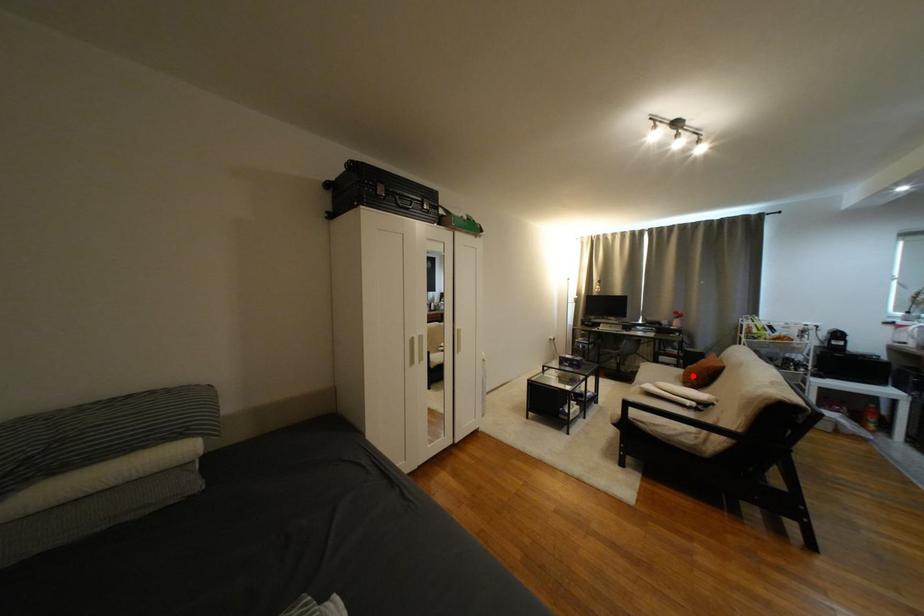
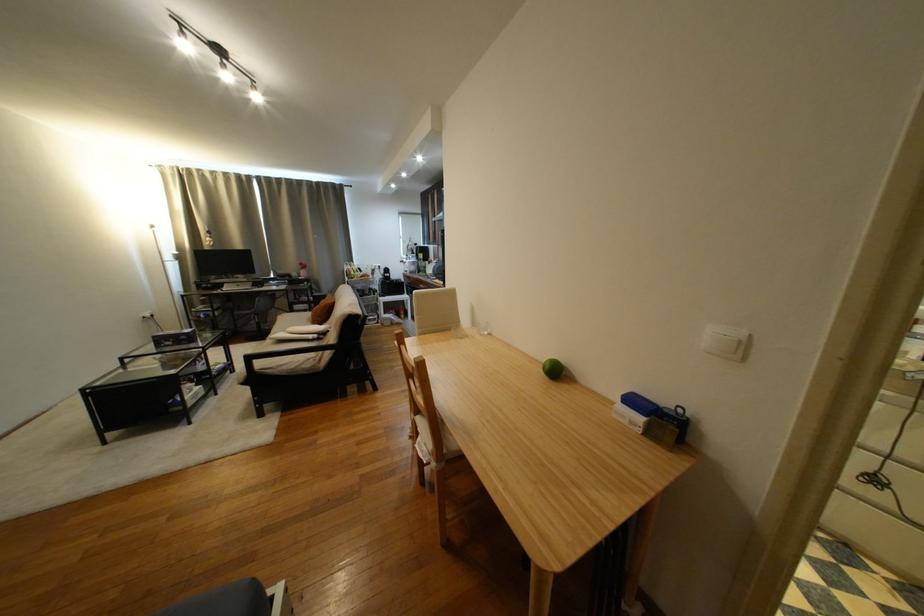
Question: A red point is marked in image1. In image2, is the corresponding 3D point closer to the camera or farther? Reply with the corresponding letter.

Choices:
 (A) The corresponding 3D point is closer.
 (B) The corresponding 3D point is farther.

Answer: (B)